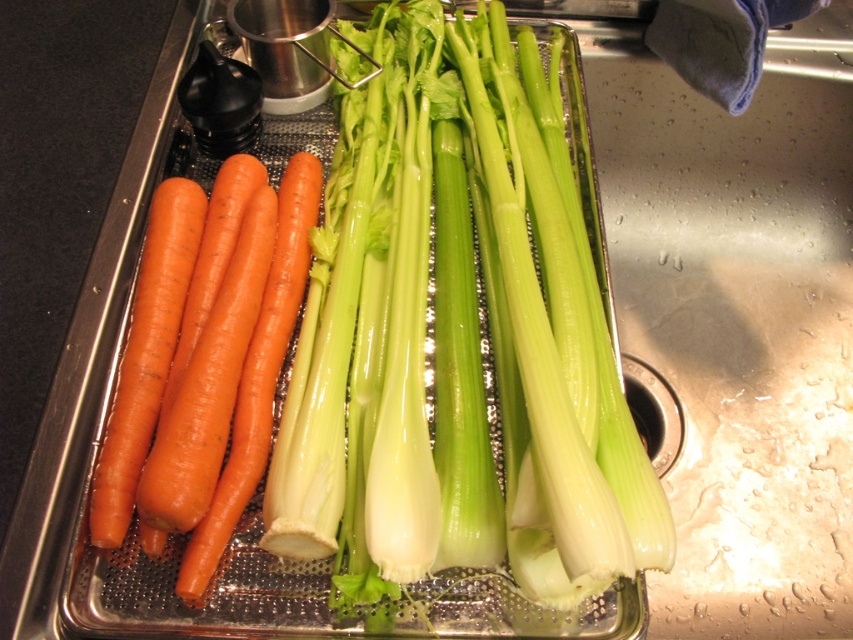
Question: Which point appears closest to the camera in this image?

Choices:
 (A) (245, 403)
 (B) (407, 444)
 (C) (155, 211)

Answer: (B)

Question: Can you confirm if orange matte carrots at left is smaller than orange matte carrot at left?

Choices:
 (A) yes
 (B) no

Answer: (B)

Question: Which of the following is the farthest from the observer?

Choices:
 (A) orange matte carrot at left
 (B) orange matte carrots at left

Answer: (A)

Question: Which point is closer to the camera?

Choices:
 (A) (198, 280)
 (B) (190, 212)

Answer: (A)

Question: Does green glossy celery at center appear on the right side of orange matte carrot at left?

Choices:
 (A) yes
 (B) no

Answer: (A)

Question: Can you confirm if green glossy celery at center is positioned to the left of orange matte carrot at left?

Choices:
 (A) no
 (B) yes

Answer: (A)